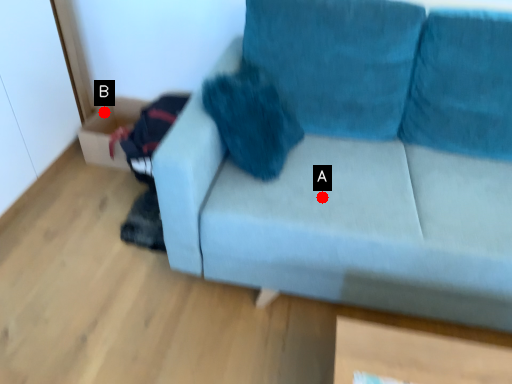
Question: Two points are circled on the image, labeled by A and B beside each circle. Which point is closer to the camera?

Choices:
 (A) A is closer
 (B) B is closer

Answer: (A)